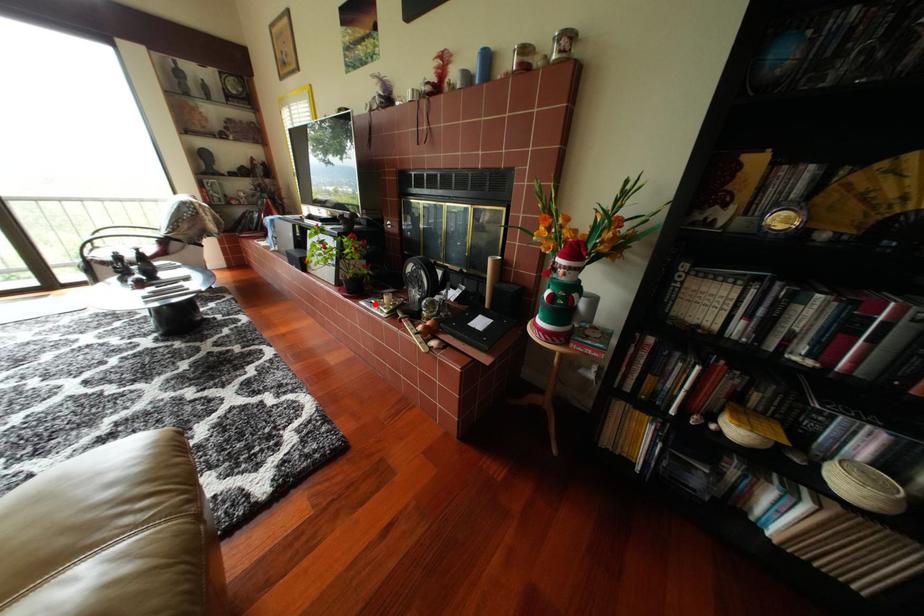
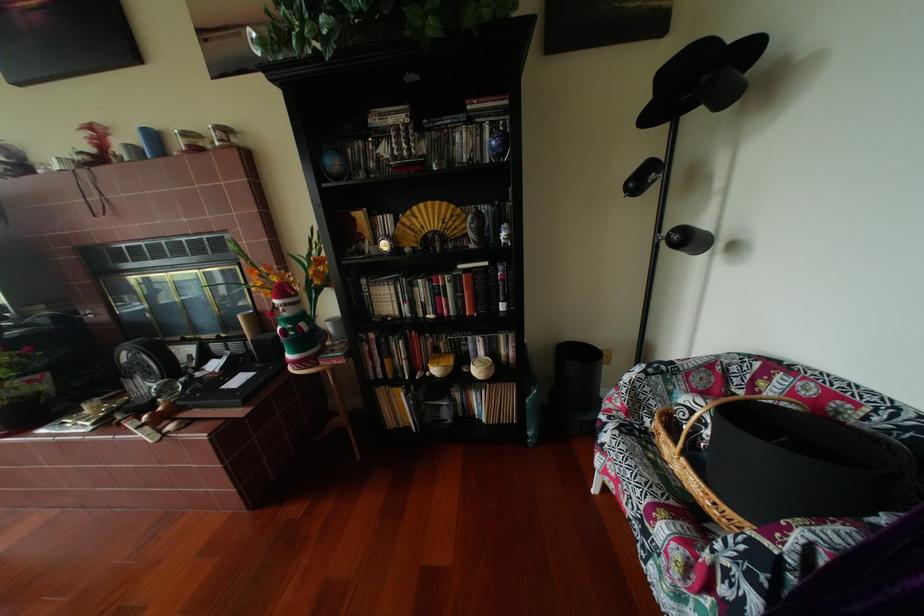
Question: A red point is marked in image1. In image2, is the corresponding 3D point closer to the camera or farther? Reply with the corresponding letter.

Choices:
 (A) The corresponding 3D point is closer.
 (B) The corresponding 3D point is farther.

Answer: (A)